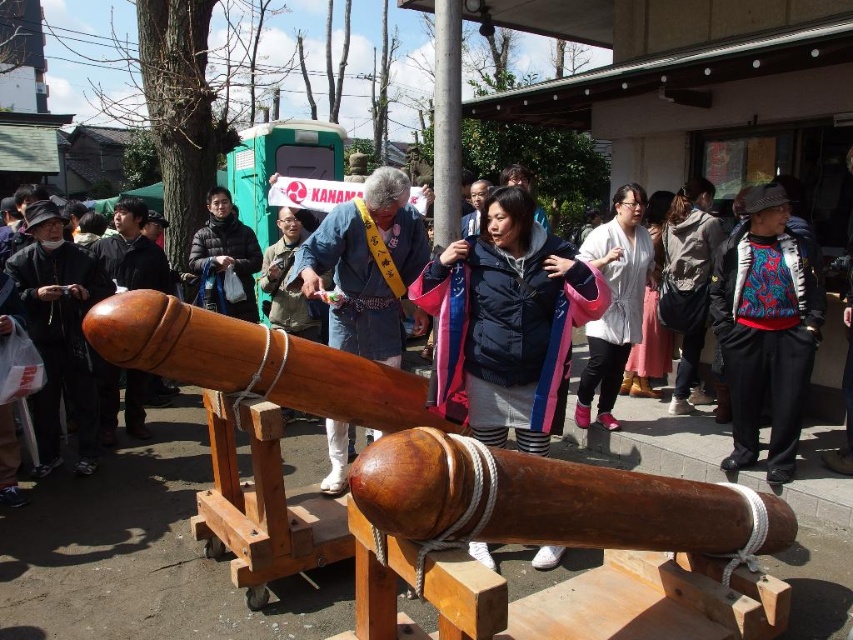
You are a participant in the event and need to pass a ceremonial item from the shiny brown wood cannon at center to the dark gray fabric jacket at center. Can you do this without moving from your current position?

→ The distance between the shiny brown wood cannon at center and the dark gray fabric jacket at center is 3.07 meters. If you can throw or pass the item that far without moving your position, then yes, it is possible.

You are standing in the middle of the event and want to move towards the closest point between point [212,353] and point [795,352]. Which point should you walk towards?

Point [212,353] is closer to the viewer than point [795,352], so you should walk towards point [212,353].

You are a photographer at the event and want to capture both the shiny brown wood cannon at center and the dark gray fabric jacket at center in a single photo. Can you position yourself so that both are visible without one blocking the other?

The shiny brown wood cannon at center is in front of the dark gray fabric jacket at center, so if you position yourself behind the dark gray fabric jacket at center, you can see both objects without the cannon blocking the jacket. Alternatively, moving to the side might allow you to capture both in the frame without obstruction.